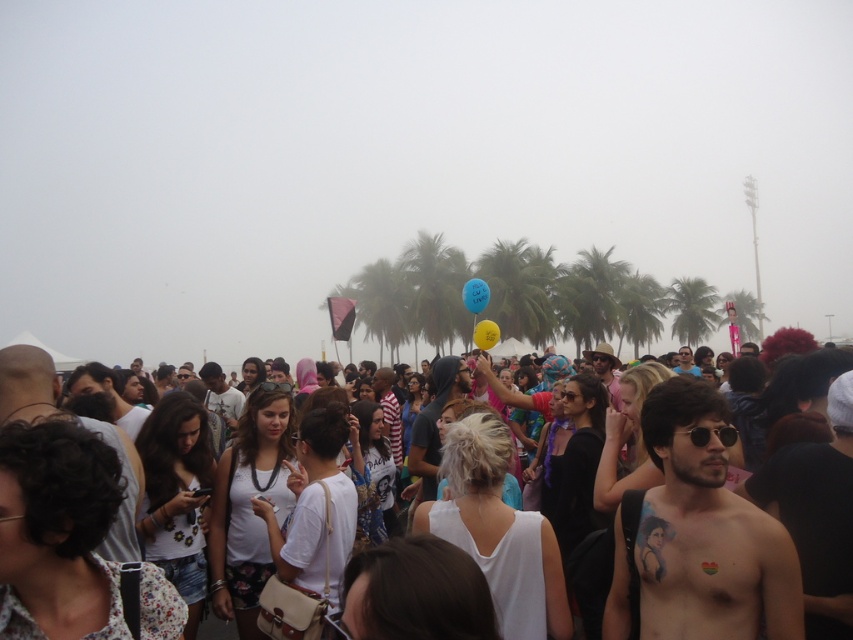
Does white cotton crowd at center have a greater width compared to yellow matte balloon at upper center?

Yes.

Can you confirm if white cotton crowd at center is positioned to the right of yellow matte balloon at upper center?

Incorrect, white cotton crowd at center is not on the right side of yellow matte balloon at upper center.

Does point (779, 422) lie in front of point (477, 282)?

Yes, point (779, 422) is in front of point (477, 282).

Where is `white cotton crowd at center`? white cotton crowd at center is located at coordinates (805, 381).

Can you confirm if white cotton crowd at center is positioned to the left of yellow rubber balloon at center?

Indeed, white cotton crowd at center is positioned on the left side of yellow rubber balloon at center.

This screenshot has height=640, width=853. Describe the element at coordinates (805, 381) in the screenshot. I see `white cotton crowd at center` at that location.

Is point (842, 448) positioned behind point (495, 326)?

No, (842, 448) is closer to viewer.

The height and width of the screenshot is (640, 853). Find the location of `white cotton crowd at center`. white cotton crowd at center is located at coordinates (805, 381).

From the picture: Which of these two, yellow matte balloon at upper center or yellow rubber balloon at center, stands taller?

yellow matte balloon at upper center

Does yellow matte balloon at upper center appear on the right side of yellow rubber balloon at center?

Incorrect, yellow matte balloon at upper center is not on the right side of yellow rubber balloon at center.

The height and width of the screenshot is (640, 853). What do you see at coordinates (474, 294) in the screenshot?
I see `yellow matte balloon at upper center` at bounding box center [474, 294].

You are a GUI agent. You are given a task and a screenshot of the screen. Output one action in this format:
    pyautogui.click(x=<x>, y=<y>)
    Task: Click on the yellow matte balloon at upper center
    This screenshot has height=640, width=853.
    Given the screenshot: What is the action you would take?
    pyautogui.click(x=474, y=294)